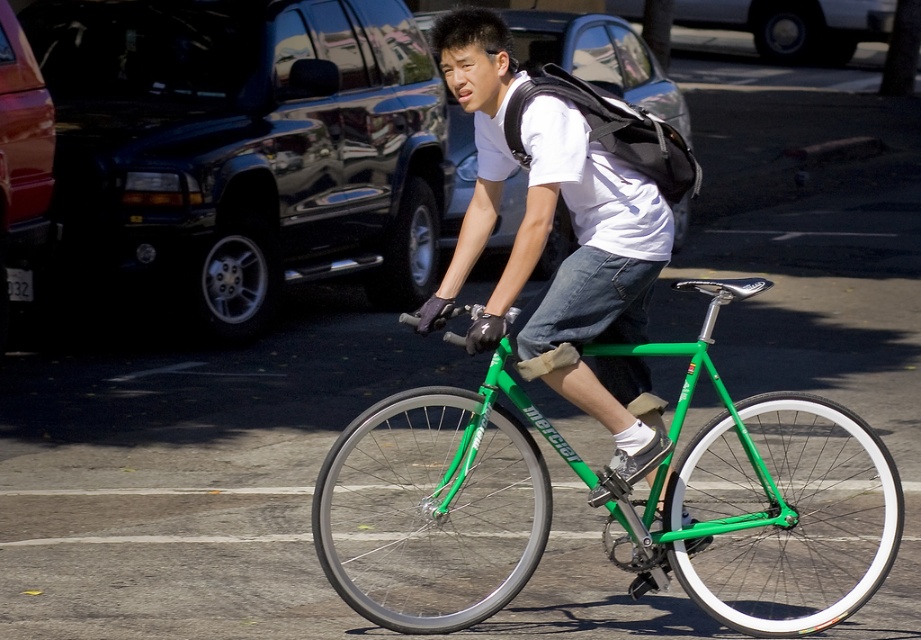
You are a cyclist planning to park your green matte bicycle at center in a spot marked by point (773, 508). The parking area has a rule that vehicles must be parked within 0.5 units of the marked spot. Can you park your bicycle there?

The green matte bicycle at center is represented by point (773, 508). Since the parking rule requires vehicles to be within 0.5 units of the spot, the distance from the bicycle to the spot is zero, so it is within the required distance. Therefore, you can park the green matte bicycle at center there.

Consider the image. You are a delivery person who needs to choose between two bicycles to deliver packages. The green matte bicycle at center and the matte green bicycle at center are available. Which one should you choose if you need a larger bike for carrying more items?

The green matte bicycle at center is bigger than the matte green bicycle at center, so you should choose the green matte bicycle at center for carrying more items.

You are a delivery person who needs to park your green matte bicycle at center near the parked cars in the background. Based on the image, can you estimate where exactly you should place it?

The green matte bicycle at center should be placed at the 2D location coordinates point (x=773, y=508) as specified in the scene description.